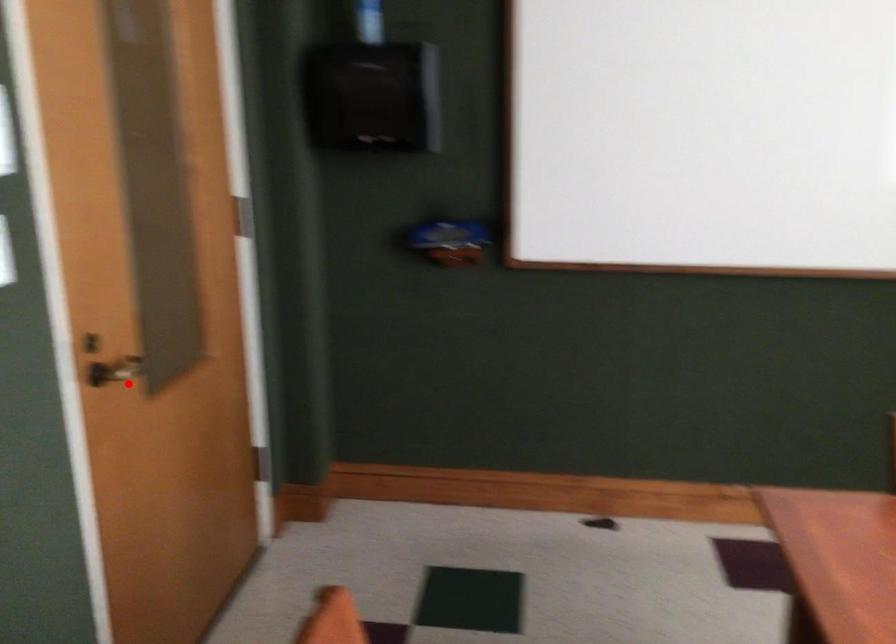
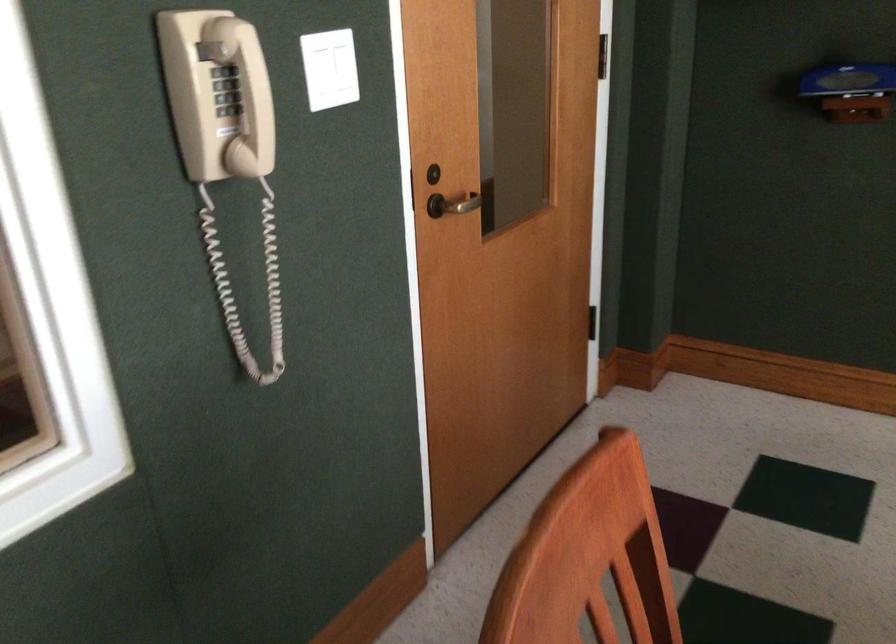
Where in the second image is the point corresponding to the highlighted location from the first image?

(458, 204)